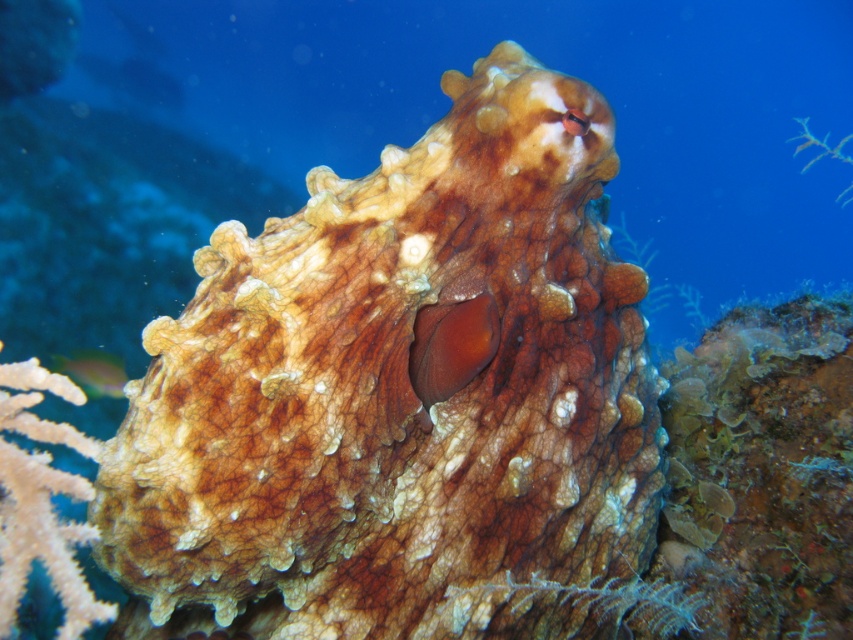
Question: Can you confirm if brown textured octopus at center is positioned below shiny green fish at lower left?

Choices:
 (A) yes
 (B) no

Answer: (B)

Question: Does brown textured octopus at center appear under shiny green fish at lower left?

Choices:
 (A) yes
 (B) no

Answer: (B)

Question: Is brown textured octopus at center wider than shiny green fish at lower left?

Choices:
 (A) yes
 (B) no

Answer: (A)

Question: Which point is farther to the camera?

Choices:
 (A) shiny green fish at lower left
 (B) brown textured octopus at center

Answer: (A)